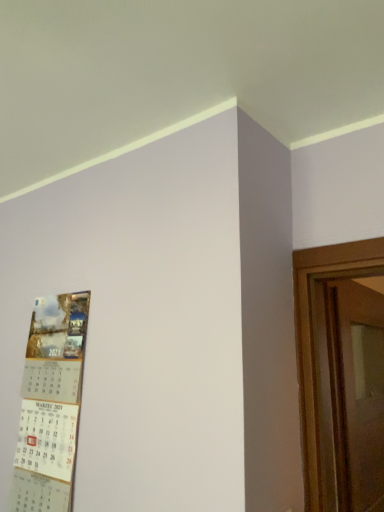
What do you see at coordinates (50, 404) in the screenshot? I see `matte paper calendar at left` at bounding box center [50, 404].

Image resolution: width=384 pixels, height=512 pixels. What are the coordinates of `matte paper calendar at left` in the screenshot? It's located at (50, 404).

What is the approximate height of wooden door at right?

The height of wooden door at right is 94.63 centimeters.

Image resolution: width=384 pixels, height=512 pixels. What do you see at coordinates (313, 337) in the screenshot?
I see `wooden door at right` at bounding box center [313, 337].

The height and width of the screenshot is (512, 384). Find the location of `wooden door at right`. wooden door at right is located at coordinates (313, 337).

Where is `matte paper calendar at left`? Image resolution: width=384 pixels, height=512 pixels. matte paper calendar at left is located at coordinates (50, 404).

Considering the relative positions of matte paper calendar at left and wooden door at right in the image provided, is matte paper calendar at left to the left of wooden door at right from the viewer's perspective?

Indeed, matte paper calendar at left is positioned on the left side of wooden door at right.

Who is more distant, matte paper calendar at left or wooden door at right?

wooden door at right is behind.

Which point is more forward, (33, 389) or (298, 284)?

The point (298, 284) is in front.

From the image's perspective, which one is positioned higher, matte paper calendar at left or wooden door at right?

matte paper calendar at left, from the image's perspective.

From the picture: From a real-world perspective, between matte paper calendar at left and wooden door at right, who is vertically higher?

matte paper calendar at left.

Looking at this image, considering the sizes of matte paper calendar at left and wooden door at right in the image, is matte paper calendar at left wider or thinner than wooden door at right?

In the image, matte paper calendar at left appears to be more narrow than wooden door at right.

Considering the relative sizes of matte paper calendar at left and wooden door at right in the image provided, is matte paper calendar at left shorter than wooden door at right?

Indeed, matte paper calendar at left has a lesser height compared to wooden door at right.

Considering the sizes of objects matte paper calendar at left and wooden door at right in the image provided, who is smaller, matte paper calendar at left or wooden door at right?

Smaller between the two is matte paper calendar at left.

Do you think matte paper calendar at left is within wooden door at right, or outside of it?

matte paper calendar at left is located beyond the bounds of wooden door at right.

Is matte paper calendar at left not near wooden door at right?

No, matte paper calendar at left is not far away from wooden door at right.

Is matte paper calendar at left facing away from wooden door at right?

matte paper calendar at left is not turned away from wooden door at right.

How much distance is there between matte paper calendar at left and wooden door at right?

A distance of 30.89 inches exists between matte paper calendar at left and wooden door at right.

Find the location of a particular element. The image size is (384, 512). door below the matte paper calendar at left (from the image's perspective) is located at coordinates (313, 337).

Between wooden door at right and matte paper calendar at left, which one appears on the right side from the viewer's perspective?

Positioned to the right is wooden door at right.

Which object is closer to the camera taking this photo, wooden door at right or matte paper calendar at left?

matte paper calendar at left is closer to the camera.

Does point (303, 313) come in front of point (83, 314)?

That is True.

From the image's perspective, would you say wooden door at right is positioned over matte paper calendar at left?

No.

From a real-world perspective, which object rests below the other?

wooden door at right is physically lower.

Between wooden door at right and matte paper calendar at left, which one has larger width?

With larger width is wooden door at right.

Considering the sizes of wooden door at right and matte paper calendar at left in the image, is wooden door at right taller or shorter than matte paper calendar at left?

Clearly, wooden door at right is taller compared to matte paper calendar at left.

Who is smaller, wooden door at right or matte paper calendar at left?

With smaller size is matte paper calendar at left.

Would you say wooden door at right contains matte paper calendar at left?

No, wooden door at right does not contain matte paper calendar at left.

Can you see wooden door at right touching matte paper calendar at left?

wooden door at right and matte paper calendar at left are not in contact.

Is wooden door at right oriented towards matte paper calendar at left?

No, wooden door at right does not turn towards matte paper calendar at left.

In the scene shown: How different are the orientations of wooden door at right and matte paper calendar at left in degrees?

89.6 degrees.

Locate an element on the screen. The height and width of the screenshot is (512, 384). door below the matte paper calendar at left (from the image's perspective) is located at coordinates (313, 337).

I want to click on door below the matte paper calendar at left (from the image's perspective), so click(x=313, y=337).

Where is `poster that is above the wooden door at right (from the image's perspective)`? The image size is (384, 512). poster that is above the wooden door at right (from the image's perspective) is located at coordinates (50, 404).